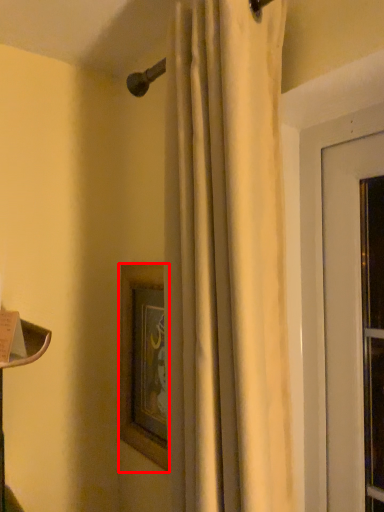
Question: From the image's perspective, what is the correct spatial relationship of picture frame (annotated by the red box) in relation to curtain?

Choices:
 (A) below
 (B) above

Answer: (A)